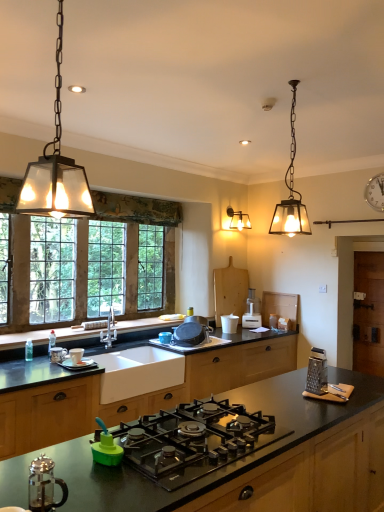
Locate an element on the screen. This screenshot has width=384, height=512. free space between clear glass french press at lower left and green plastic bottle at lower center, which is the 2th appliance in left-to-right order is located at coordinates tap(88, 484).